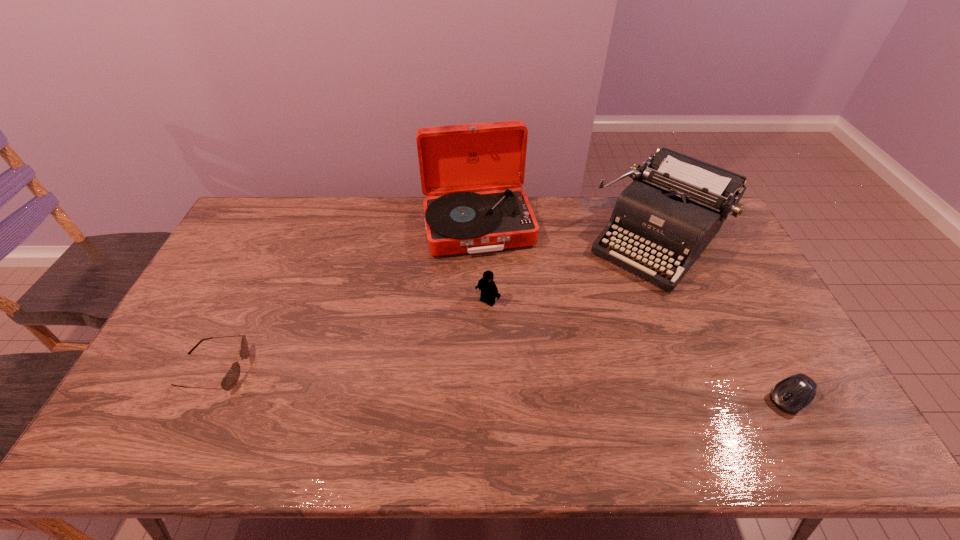
The width and height of the screenshot is (960, 540). Identify the location of vacant region located 0.300m on the front-facing side of the tallest object. (505, 329).

Where is `vacant space situated 0.370m on the front-facing side of the tallest object`? vacant space situated 0.370m on the front-facing side of the tallest object is located at coordinates (510, 349).

What are the coordinates of `vacant space located 0.060m on the front-facing side of the tallest object` in the screenshot? It's located at (491, 272).

The image size is (960, 540). What are the coordinates of `free point located 0.290m on the front-facing side of the typewriter` in the screenshot? It's located at (574, 334).

This screenshot has height=540, width=960. What are the coordinates of `free spot located 0.380m on the front-facing side of the typewriter` in the screenshot? It's located at (557, 354).

This screenshot has height=540, width=960. I want to click on free space located on the front-facing side of the typewriter, so (x=592, y=314).

Locate an element on the screen. phonograph_record that is at the far edge is located at coordinates (455, 161).

At what (x,y) coordinates should I click in order to perform the action: click on typewriter that is at the far edge. Please return your answer as a coordinate pair (x, y). Looking at the image, I should click on (676, 204).

In order to click on sunglasses present at the near edge in this screenshot , I will do `click(231, 378)`.

Find the location of a particular element. Image resolution: width=960 pixels, height=540 pixels. mouse that is at the near edge is located at coordinates (790, 395).